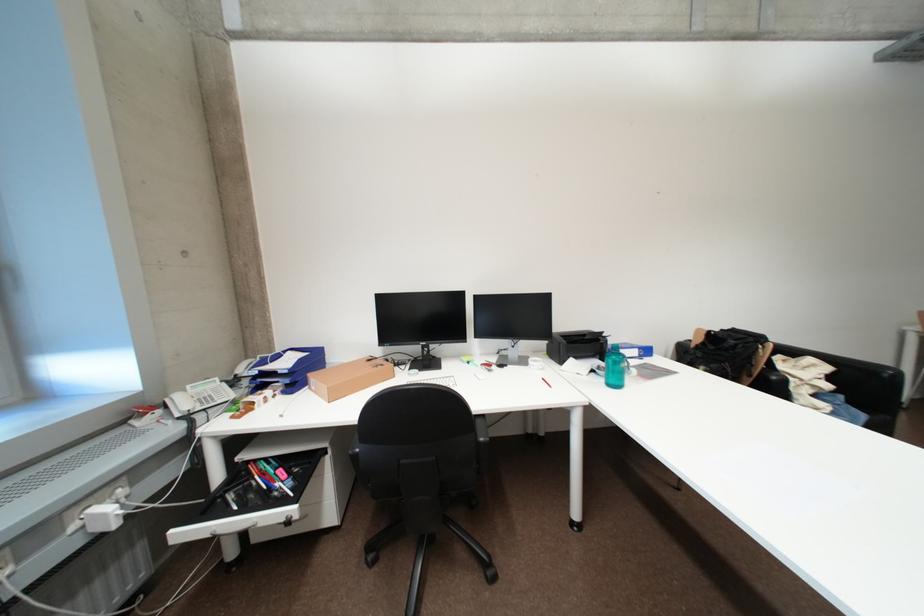
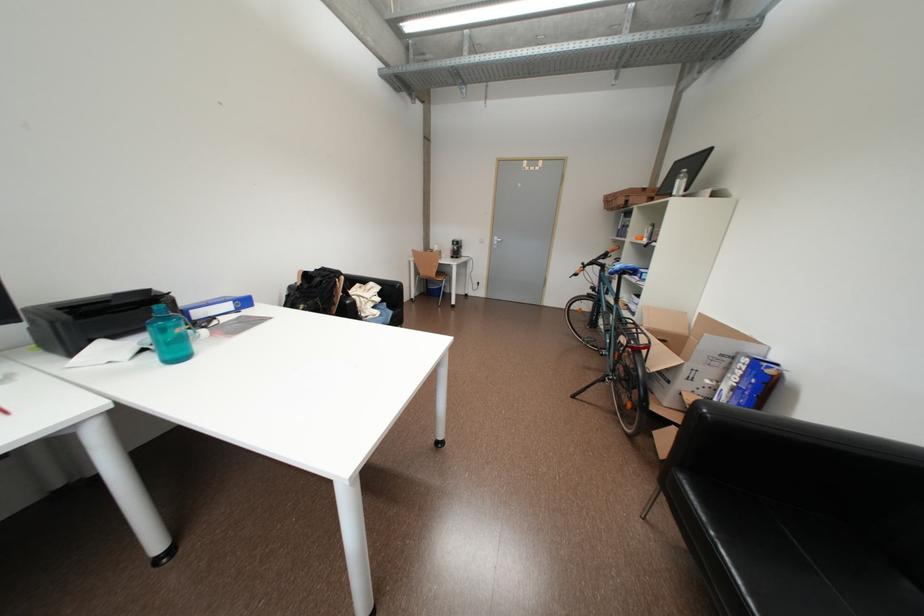
Where in the second image is the point corresponding to (x=623, y=387) from the first image?

(186, 360)